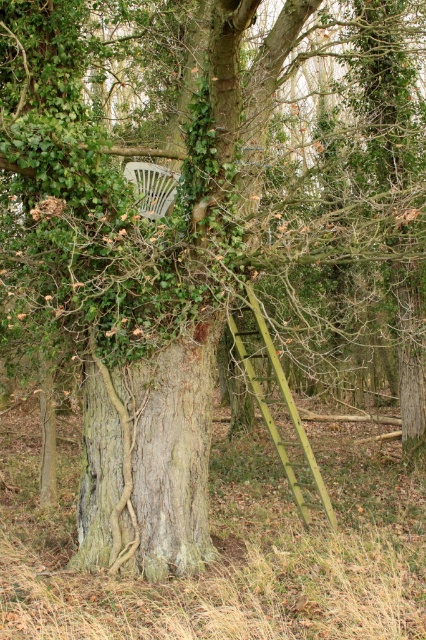
Question: Considering the relative positions of smooth bark tree trunk at center and white plastic chair at center in the image provided, where is smooth bark tree trunk at center located with respect to white plastic chair at center?

Choices:
 (A) below
 (B) above

Answer: (A)

Question: Does smooth bark tree trunk at center have a lesser width compared to white plastic chair at center?

Choices:
 (A) yes
 (B) no

Answer: (B)

Question: Is smooth bark tree trunk at center smaller than white plastic chair at center?

Choices:
 (A) yes
 (B) no

Answer: (B)

Question: Which object is farther from the camera taking this photo?

Choices:
 (A) white plastic chair at center
 (B) smooth bark tree trunk at center

Answer: (A)

Question: Which point is closer to the camera?

Choices:
 (A) (158, 216)
 (B) (204, 412)

Answer: (B)

Question: Which point is farther to the camera?

Choices:
 (A) smooth bark tree trunk at center
 (B) white plastic chair at center

Answer: (B)